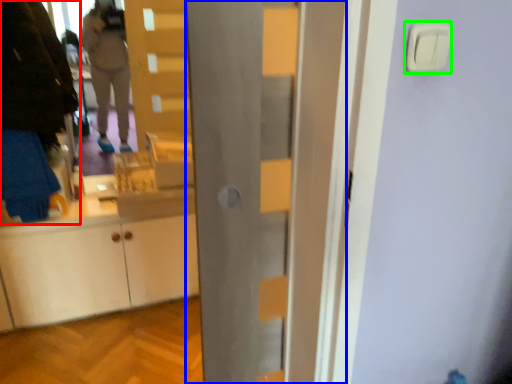
Question: Which object is the farthest from person (highlighted by a red box)? Choose among these: door (highlighted by a blue box) or light switch (highlighted by a green box).

Choices:
 (A) door
 (B) light switch

Answer: (B)